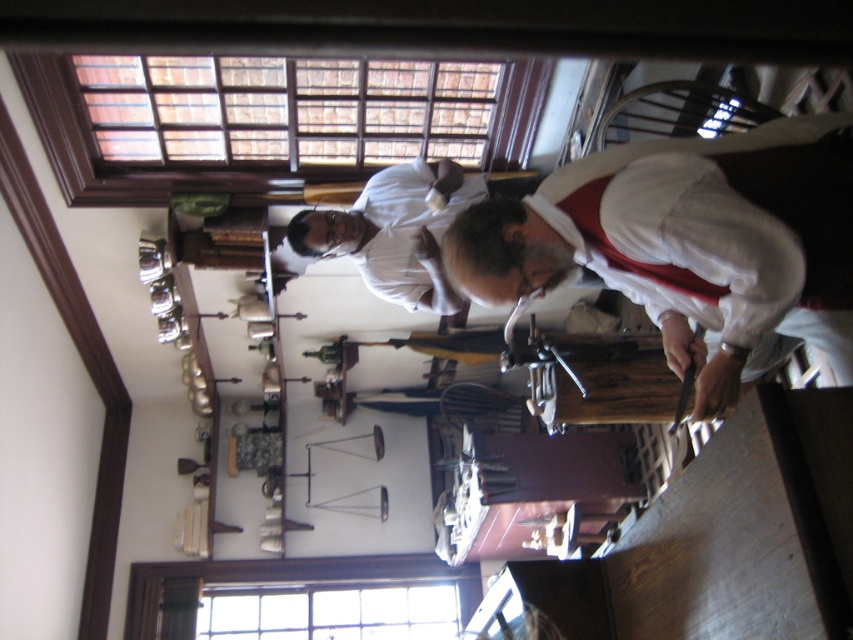
You are standing in the historical workshop scene. You need to locate the white matte shirt at center. According to the coordinates provided, where exactly would you find it?

The white matte shirt at center is located at the coordinates point (689, 243).

Consider the image. You are standing in the historical workshop and want to determine which of the two points, point (688, 262) or point (428, 250), is nearer to you. Based on the scene, which point is closer?

Point (688, 262) is closer to the viewer than point (428, 250).

You are observing two people in the scene. One is wearing a white matte shirt at center and the other a white matte shirt at upper center. From the perspective of someone standing in front of the table, which shirt is located to the right?

The white matte shirt at center is positioned on the right side of the white matte shirt at upper center.